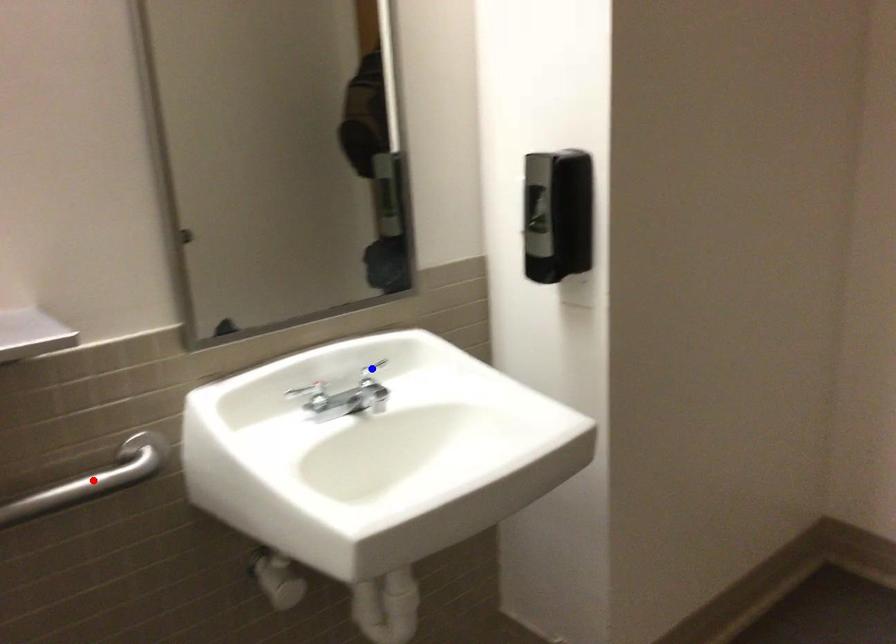
Question: Two points are marked on the image. Which point is closer to the camera?

Choices:
 (A) Blue point is closer.
 (B) Red point is closer.

Answer: (B)